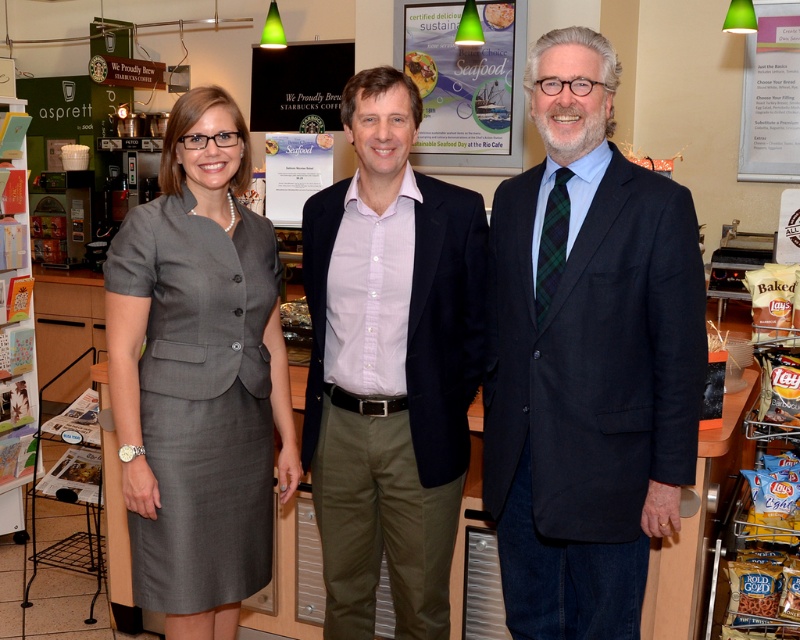
Question: Among these objects, which one is farthest from the camera?

Choices:
 (A) dark blue suit at center
 (B) pink button-down shirt at center
 (C) gray fabric dress at left

Answer: (C)

Question: Among these objects, which one is nearest to the camera?

Choices:
 (A) dark blue suit at center
 (B) matte paper poster at center
 (C) pink button-down shirt at center

Answer: (A)

Question: Is pink button-down shirt at center to the right of matte paper poster at center from the viewer's perspective?

Choices:
 (A) yes
 (B) no

Answer: (B)

Question: Which point is closer to the camera?

Choices:
 (A) (440, 621)
 (B) (704, 356)
 (C) (488, 230)

Answer: (B)

Question: Considering the relative positions of matte paper poster at center and white paper at upper right in the image provided, where is matte paper poster at center located with respect to white paper at upper right?

Choices:
 (A) below
 (B) above

Answer: (B)

Question: Observing the image, what is the correct spatial positioning of dark blue suit at center in reference to white paper at upper right?

Choices:
 (A) right
 (B) left

Answer: (B)